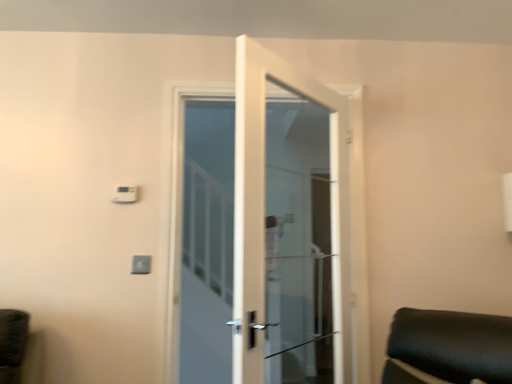
Question: Can you confirm if white glass door at center is smaller than white plastic light switch at upper center, positioned as the first light switch in left-to-right order?

Choices:
 (A) no
 (B) yes

Answer: (A)

Question: Is white glass door at center not close to white plastic light switch at upper center, which appears as the 1th light switch when viewed from the top?

Choices:
 (A) yes
 (B) no

Answer: (A)

Question: Is white glass door at center wider than white plastic light switch at upper center, the second light switch in the bottom-to-top sequence?

Choices:
 (A) yes
 (B) no

Answer: (A)

Question: Are white glass door at center and white plastic light switch at upper center, the second light switch in the bottom-to-top sequence, making contact?

Choices:
 (A) yes
 (B) no

Answer: (B)

Question: Can you confirm if white glass door at center is positioned to the right of white plastic light switch at upper center, the second light switch in the bottom-to-top sequence?

Choices:
 (A) no
 (B) yes

Answer: (B)

Question: From the image's perspective, is white glass door at center on top of white plastic light switch at upper center, which appears as the 1th light switch when viewed from the top?

Choices:
 (A) no
 (B) yes

Answer: (A)

Question: Considering the relative sizes of white plastic light switch at upper center, which appears as the second light switch when viewed from the left, and white plastic light switch at upper center, the second light switch in the bottom-to-top sequence, in the image provided, is white plastic light switch at upper center, which appears as the second light switch when viewed from the left, thinner than white plastic light switch at upper center, the second light switch in the bottom-to-top sequence,?

Choices:
 (A) no
 (B) yes

Answer: (B)

Question: Does white plastic light switch at upper center, the 2th light switch in the top-to-bottom sequence, appear on the left side of white plastic light switch at upper center, the second light switch in the bottom-to-top sequence?

Choices:
 (A) no
 (B) yes

Answer: (A)

Question: Is white plastic light switch at upper center, which ranks as the second light switch in right-to-left order, surrounded by white plastic light switch at upper center, which is the 1th light switch from bottom to top?

Choices:
 (A) no
 (B) yes

Answer: (A)

Question: Can you confirm if white plastic light switch at upper center, which appears as the second light switch when viewed from the left, is shorter than white plastic light switch at upper center, which ranks as the second light switch in right-to-left order?

Choices:
 (A) no
 (B) yes

Answer: (B)

Question: Is white plastic light switch at upper center, acting as the 1th light switch starting from the right, positioned behind white plastic light switch at upper center, positioned as the first light switch in left-to-right order?

Choices:
 (A) yes
 (B) no

Answer: (B)

Question: Is white plastic light switch at upper center, acting as the 1th light switch starting from the right, turned away from white plastic light switch at upper center, which ranks as the second light switch in right-to-left order?

Choices:
 (A) no
 (B) yes

Answer: (A)

Question: Is white plastic light switch at upper center, which is the 1th light switch from bottom to top, at the back of white glass door at center?

Choices:
 (A) yes
 (B) no

Answer: (B)